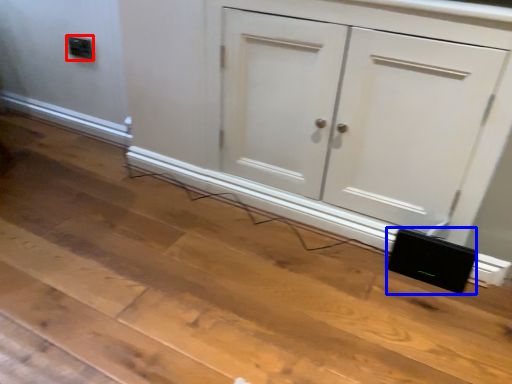
Question: Which point is further to the camera, electric outlet (highlighted by a red box) or speaker (highlighted by a blue box)?

Choices:
 (A) electric outlet
 (B) speaker

Answer: (A)